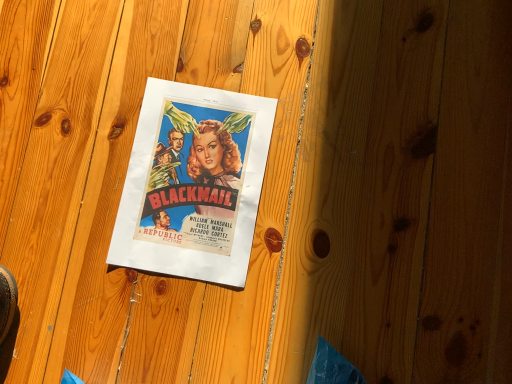
Question: Should I look upward or downward to see matte paper poster at center?

Choices:
 (A) up
 (B) down

Answer: (A)